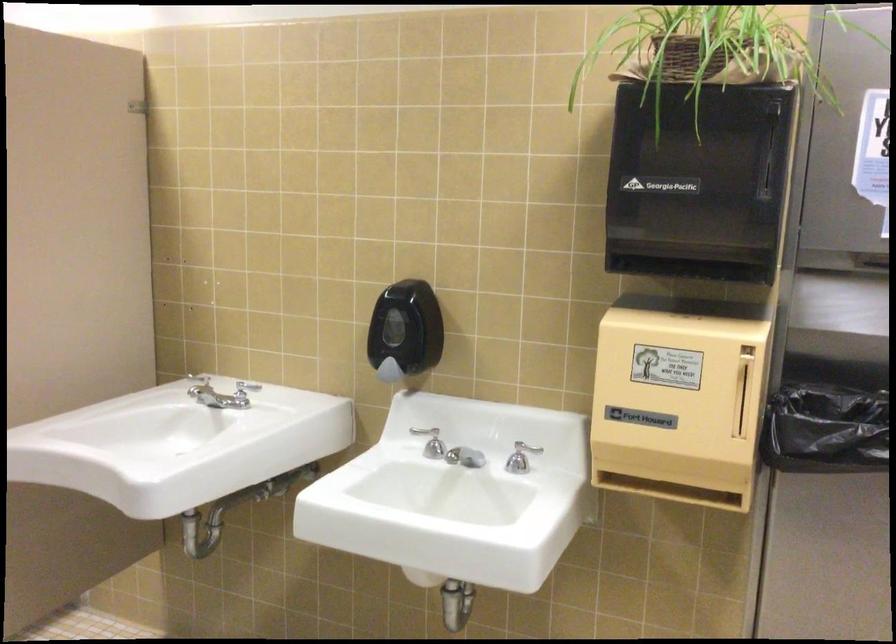
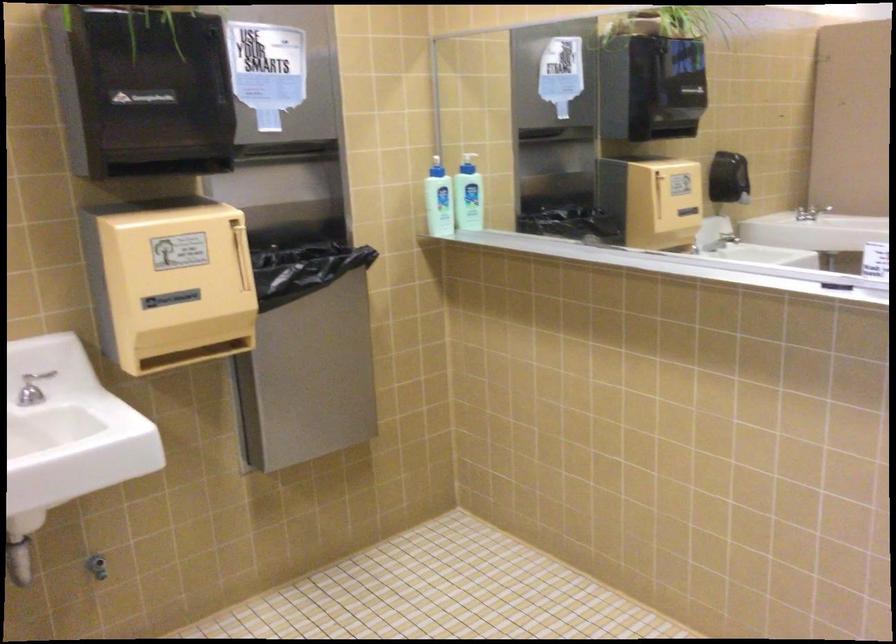
Question: Based on the continuous images, in which direction is the camera rotating? Reply with the corresponding letter.

Choices:
 (A) Left
 (B) Right
 (C) Up
 (D) Down

Answer: (B)